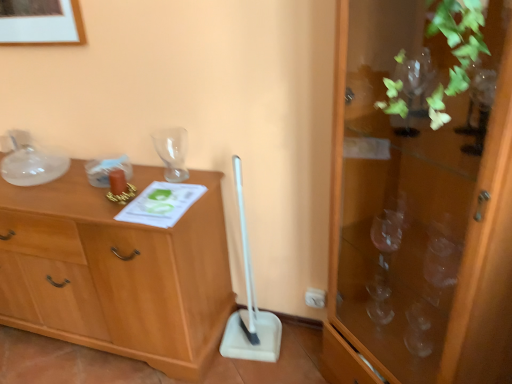
Question: Does transparent glass vase at upper center have a lesser height compared to transparent glass cabinet at right?

Choices:
 (A) yes
 (B) no

Answer: (A)

Question: Is transparent glass vase at upper center closer to camera compared to transparent glass cabinet at right?

Choices:
 (A) yes
 (B) no

Answer: (B)

Question: From a real-world perspective, is transparent glass vase at upper center over transparent glass cabinet at right?

Choices:
 (A) yes
 (B) no

Answer: (A)

Question: Are transparent glass vase at upper center and transparent glass cabinet at right far apart?

Choices:
 (A) yes
 (B) no

Answer: (B)

Question: From the image's perspective, would you say transparent glass vase at upper center is shown under transparent glass cabinet at right?

Choices:
 (A) no
 (B) yes

Answer: (A)

Question: Is transparent glass cabinet at right wider or thinner than white plastic shovel at center?

Choices:
 (A) wide
 (B) thin

Answer: (A)

Question: From a real-world perspective, relative to white plastic shovel at center, is transparent glass cabinet at right vertically above or below?

Choices:
 (A) above
 (B) below

Answer: (A)

Question: Considering the relative positions of transparent glass cabinet at right and white plastic shovel at center in the image provided, is transparent glass cabinet at right to the left or to the right of white plastic shovel at center?

Choices:
 (A) left
 (B) right

Answer: (B)

Question: Is transparent glass cabinet at right taller or shorter than white plastic shovel at center?

Choices:
 (A) tall
 (B) short

Answer: (A)

Question: Relative to transparent glass cabinet at right, is white plastic shovel at center in front or behind?

Choices:
 (A) behind
 (B) front

Answer: (A)

Question: Is point (266, 349) positioned closer to the camera than point (353, 198)?

Choices:
 (A) farther
 (B) closer

Answer: (A)

Question: From a real-world perspective, is white plastic shovel at center physically located above or below transparent glass cabinet at right?

Choices:
 (A) below
 (B) above

Answer: (A)

Question: In terms of height, does white plastic shovel at center look taller or shorter compared to transparent glass cabinet at right?

Choices:
 (A) short
 (B) tall

Answer: (A)

Question: Is transparent glass vase at upper center inside or outside of wooden chest of drawers at left?

Choices:
 (A) outside
 (B) inside

Answer: (A)

Question: From the image's perspective, is transparent glass vase at upper center located above or below wooden chest of drawers at left?

Choices:
 (A) below
 (B) above

Answer: (B)